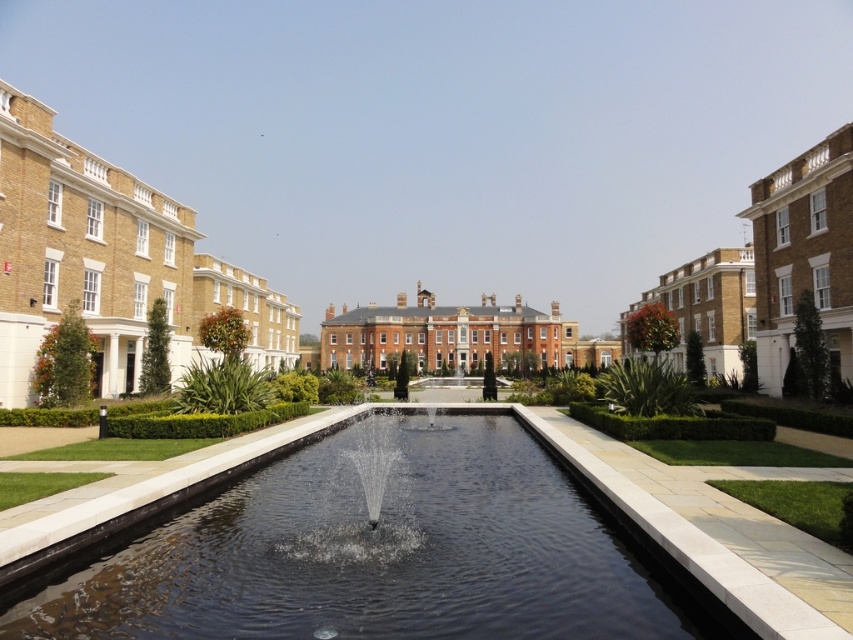
You are standing at the central building and want to reach the point marked as point (x=28, y=356). However, there is an obstacle at point (x=273, y=493). Can you walk directly to your destination without going around the obstacle?

Point (x=28, y=356) is behind point (x=273, y=493), so you cannot walk directly to point (x=28, y=356) without going around the obstacle at point (x=273, y=493).

You are a gardener planning to install a new decorative feature in the garden. The clear glass pond at center and the clear glass fountain at center are both located in the central garden area. Which of these two features has a greater width?

The clear glass pond at center has a greater width than the clear glass fountain at center according to the description provided.